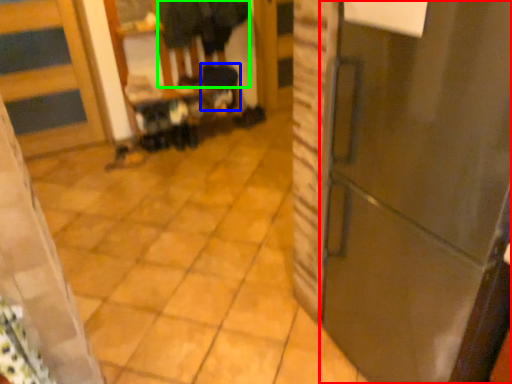
Question: Considering the real-world distances, which object is closest to door (highlighted by a red box)? step stool (highlighted by a blue box) or couple (highlighted by a green box).

Choices:
 (A) step stool
 (B) couple

Answer: (B)